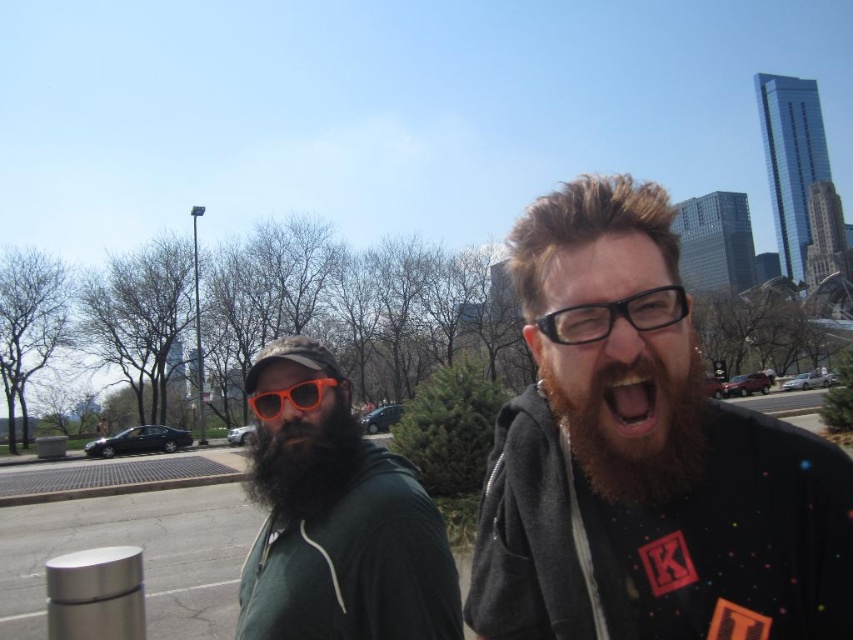
Can you confirm if dark gray hoodie at center is wider than dark brown thick beard at center?

Incorrect, dark gray hoodie at center's width does not surpass dark brown thick beard at center's.

At what (x,y) coordinates should I click in order to perform the action: click on dark gray hoodie at center. Please return your answer as a coordinate pair (x, y). The height and width of the screenshot is (640, 853). Looking at the image, I should click on coord(643,458).

This screenshot has width=853, height=640. What do you see at coordinates (335, 516) in the screenshot?
I see `green matte hoodie at center` at bounding box center [335, 516].

Which is behind, point (264, 442) or point (607, 320)?

The point (264, 442) is more distant.

Which is in front, point (437, 560) or point (631, 300)?

Positioned in front is point (631, 300).

The width and height of the screenshot is (853, 640). I want to click on green matte hoodie at center, so click(x=335, y=516).

Is dark gray hoodie at center to the left of green matte hoodie at center from the viewer's perspective?

No, dark gray hoodie at center is not to the left of green matte hoodie at center.

Is dark gray hoodie at center in front of green matte hoodie at center?

Yes, dark gray hoodie at center is closer to the viewer.

Is point (778, 616) less distant than point (300, 461)?

Yes, point (778, 616) is in front of point (300, 461).

Locate an element on the screen. dark gray hoodie at center is located at coordinates (643, 458).